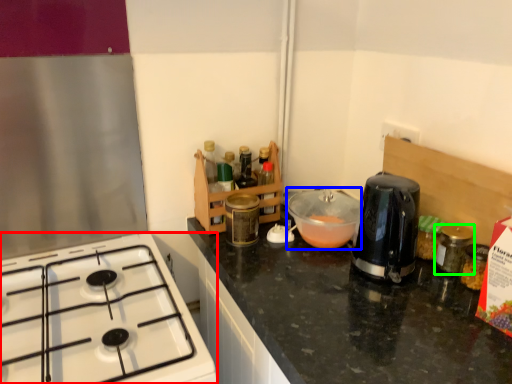
Question: Which is farther away from gas stove (highlighted by a red box)? bowl (highlighted by a blue box) or bottle (highlighted by a green box)?

Choices:
 (A) bowl
 (B) bottle

Answer: (B)